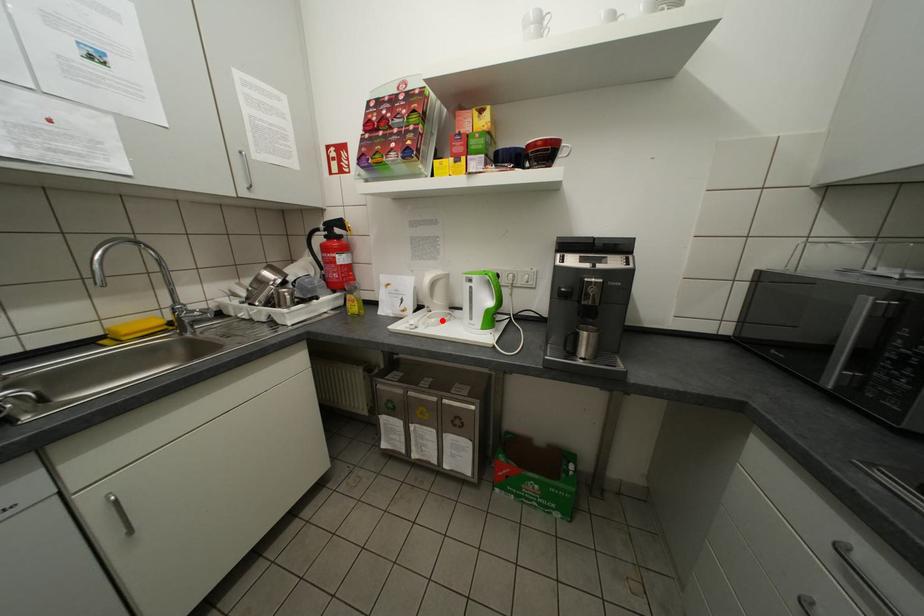
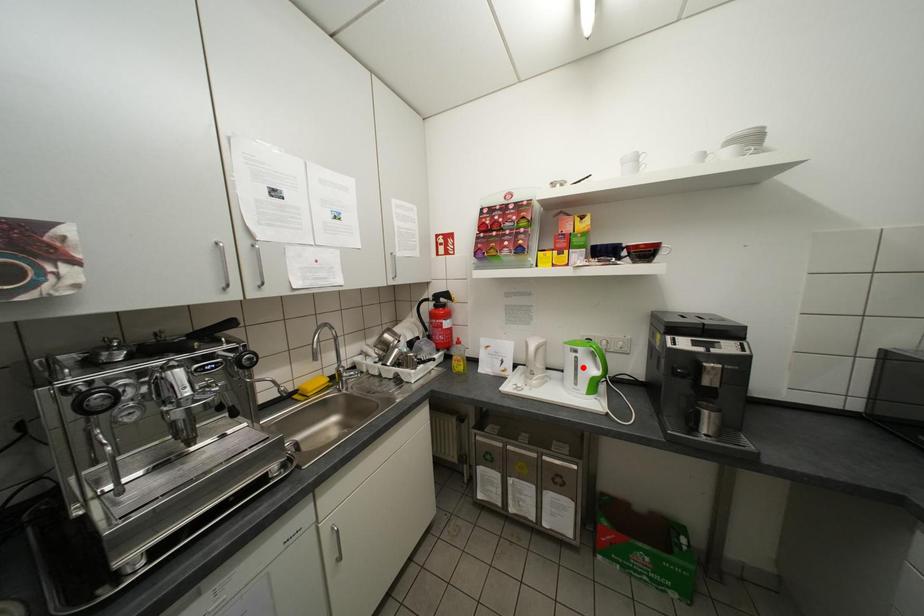
I am providing you with two images of the same scene from different viewpoints. A red point is marked on the first image and another point is marked on the second image. Is the marked point in image1 the same physical position as the marked point in image2?

No